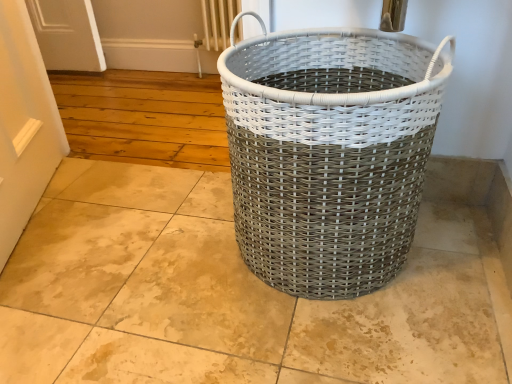
Locate an element on the screen. free space to the left of white woven basket at center is located at coordinates (159, 258).